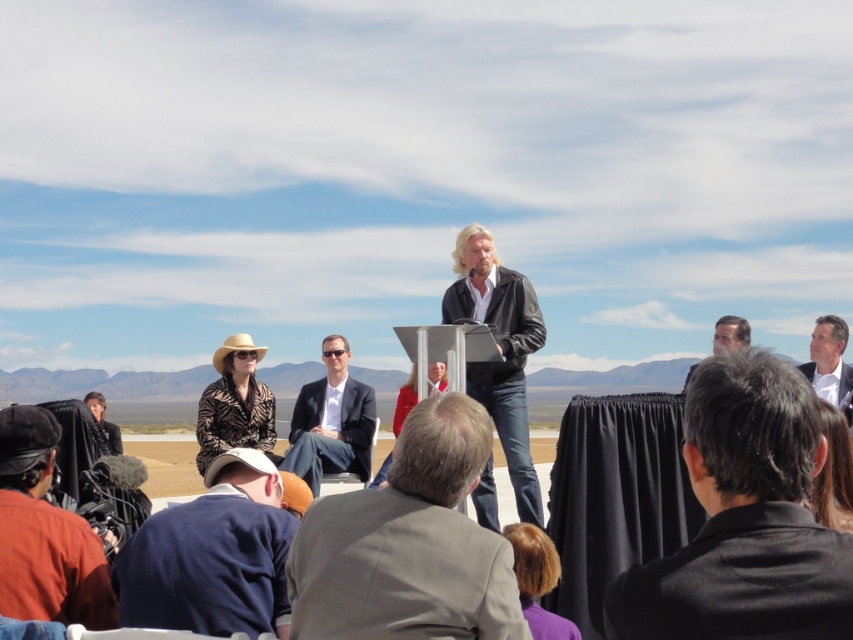
Does matte black camera at lower left appear on the left side of dark blue suit at center?

Yes, matte black camera at lower left is to the left of dark blue suit at center.

Measure the distance between point (49,524) and camera.

The distance of point (49,524) from camera is 15.51 meters.

This screenshot has height=640, width=853. What are the coordinates of `matte black camera at lower left` in the screenshot? It's located at (44, 532).

Which of these two, leopard print hat at lower left or matte red coat at center, stands taller?

With more height is matte red coat at center.

Is leopard print hat at lower left wider than matte red coat at center?

Correct, the width of leopard print hat at lower left exceeds that of matte red coat at center.

Which is behind, point (252, 422) or point (410, 388)?

Point (252, 422)

This screenshot has height=640, width=853. Identify the location of leopard print hat at lower left. (235, 404).

Who is positioned more to the left, blonde hair at center or matte red coat at center?

Positioned to the left is matte red coat at center.

Does point (815, 502) come in front of point (399, 394)?

Yes, it is.

Identify the location of blonde hair at center. (834, 474).